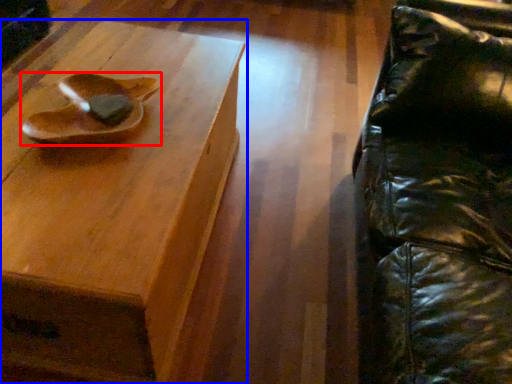
Question: Which point is closer to the camera, footwear (highlighted by a red box) or table (highlighted by a blue box)?

Choices:
 (A) footwear
 (B) table

Answer: (B)